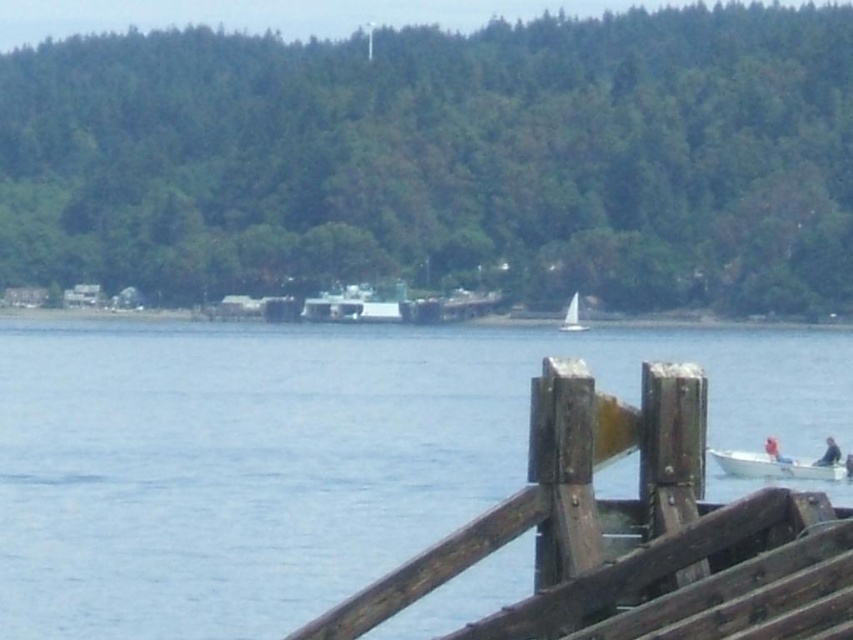
You are standing on the brown wooden dock at lower right and looking towards the white sailboat at center. Which object is taller from your perspective?

The brown wooden dock at lower right is taller than the white sailboat at center according to the description.

You are standing on the wooden railing at lower right and want to throw a rope to the white plastic boat at lower right. The rope you have is 40 feet long. Will the rope reach the boat?

The distance between the wooden railing at lower right and the white plastic boat at lower right is 40.85 feet. Since the rope is only 40 feet long, it will not be long enough to reach the boat.